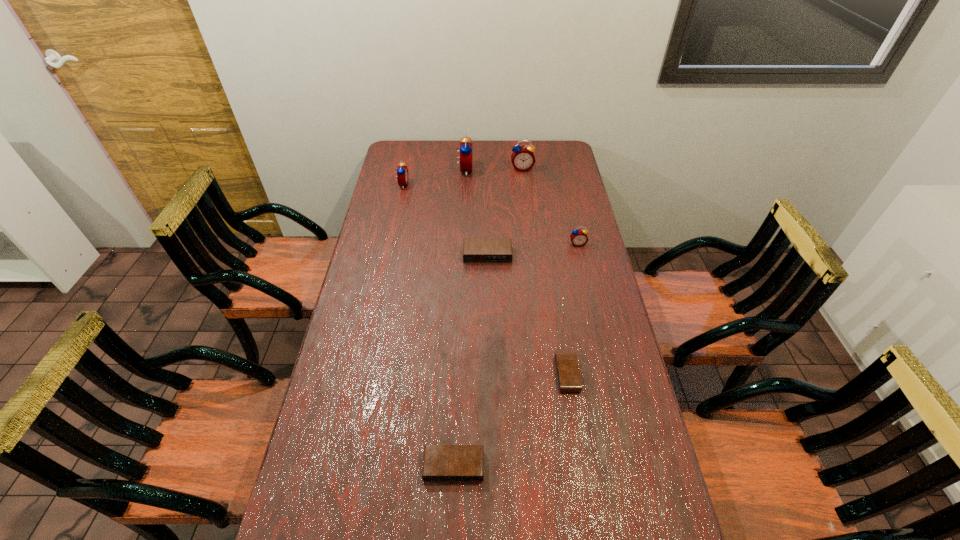
Identify the location of alarm clock that is the fifth nearest to the fifth shortest object. (568, 375).

Find the location of a particular element. This screenshot has width=960, height=540. the closest alarm clock to the rightmost alarm clock is located at coordinates (475, 250).

Where is `red alarm clock that is the second closest to the sixth shortest alarm clock`? The width and height of the screenshot is (960, 540). red alarm clock that is the second closest to the sixth shortest alarm clock is located at coordinates point(402,171).

Select which red alarm clock appears as the third closest to the third red alarm clock from right to left. Please provide its 2D coordinates. Your answer should be formatted as a tuple, i.e. [(x, y)], where the tuple contains the x and y coordinates of a point satisfying the conditions above.

[(579, 237)]

Locate an element on the screen. The height and width of the screenshot is (540, 960). the second closest black alarm clock to the sixth tallest alarm clock is located at coordinates (475, 250).

What are the coordinates of `the second closest black alarm clock to the rightmost red alarm clock` in the screenshot? It's located at (568, 375).

You are a GUI agent. You are given a task and a screenshot of the screen. Output one action in this format:
    pyautogui.click(x=<x>, y=<y>)
    Task: Click on the blank area in the image that satisfies the following two spatial constraints: 1. on the front-facing side of the second tallest alarm clock; 2. on the front-facing side of the leftmost red alarm clock
    
    Given the screenshot: What is the action you would take?
    pyautogui.click(x=524, y=185)

The width and height of the screenshot is (960, 540). Find the location of `vacant position in the image that satisfies the following two spatial constraints: 1. on the front-facing side of the second tallest object; 2. on the front-facing side of the tallest object`. vacant position in the image that satisfies the following two spatial constraints: 1. on the front-facing side of the second tallest object; 2. on the front-facing side of the tallest object is located at coordinates (522, 170).

Find the location of a particular element. Image resolution: width=960 pixels, height=540 pixels. blank space that satisfies the following two spatial constraints: 1. on the front face of the shortest object; 2. on the front face of the nearest alarm clock is located at coordinates (582, 466).